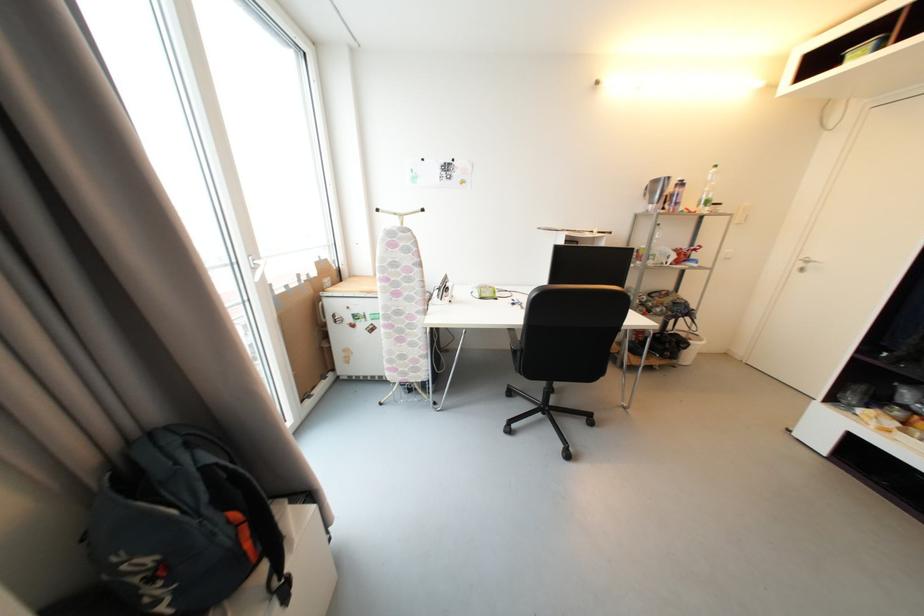
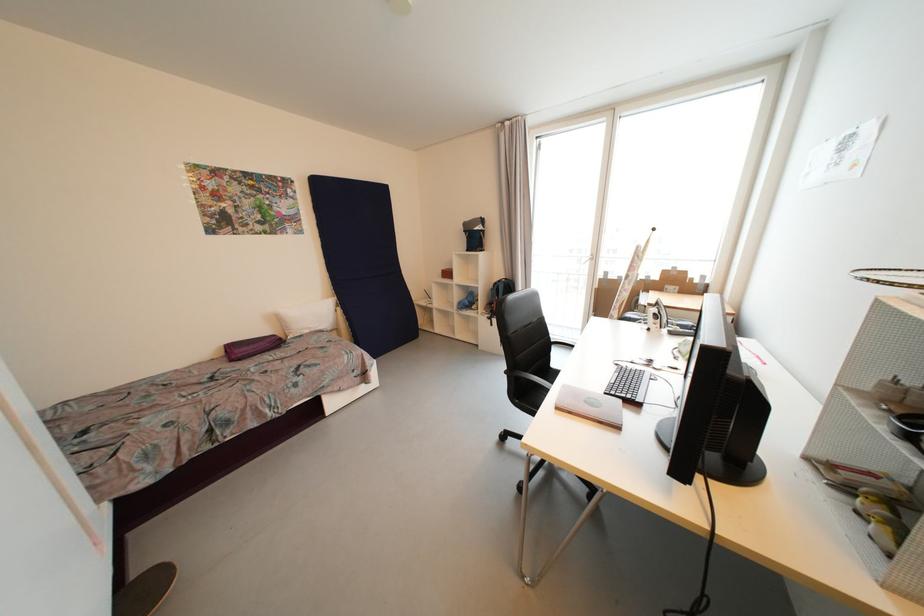
Where in the second image is the point corresponding to pixel 516 331 from the first image?

(577, 344)